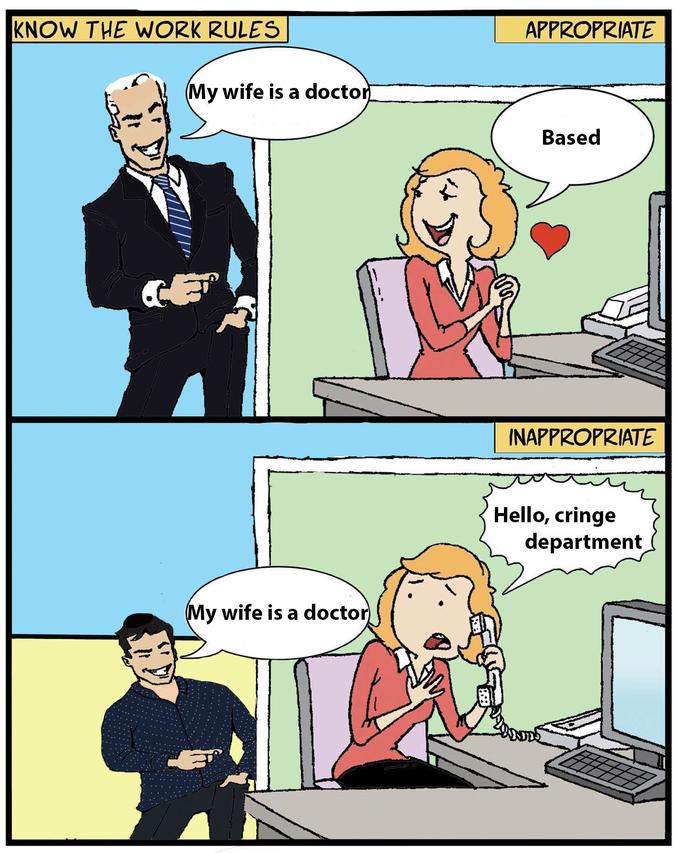
The height and width of the screenshot is (853, 680). Find the location of `desk top`. desk top is located at coordinates (352, 820), (456, 403), (508, 810).